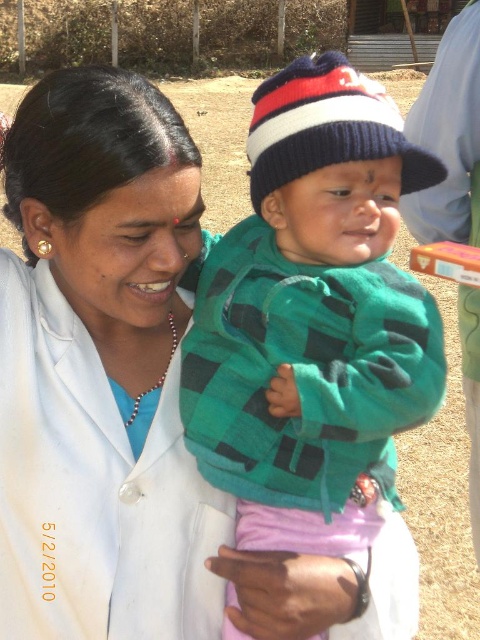
You are a photographer trying to capture the baby in the green plaid sweater at center. You want to ensure the white smooth lab coat at center doesn not block the baby. Based on their positions, which direction should you move the lab coat to keep the baby visible?

The white smooth lab coat at center is positioned on the left side of green plaid sweater at center. To keep the baby visible, move the lab coat to the right so it no longer blocks the sweater.

Based on the scene description, where is the white smooth lab coat at center located in terms of its 2D coordinates?

The white smooth lab coat at center is located at the 2D coordinates point (100, 371).

You are a healthcare professional observing this scene. You need to determine the position of the white smooth lab coat at center relative to the green plaid sweater at center. Is the lab coat above or below the sweater?

The white smooth lab coat at center is below the green plaid sweater at center.